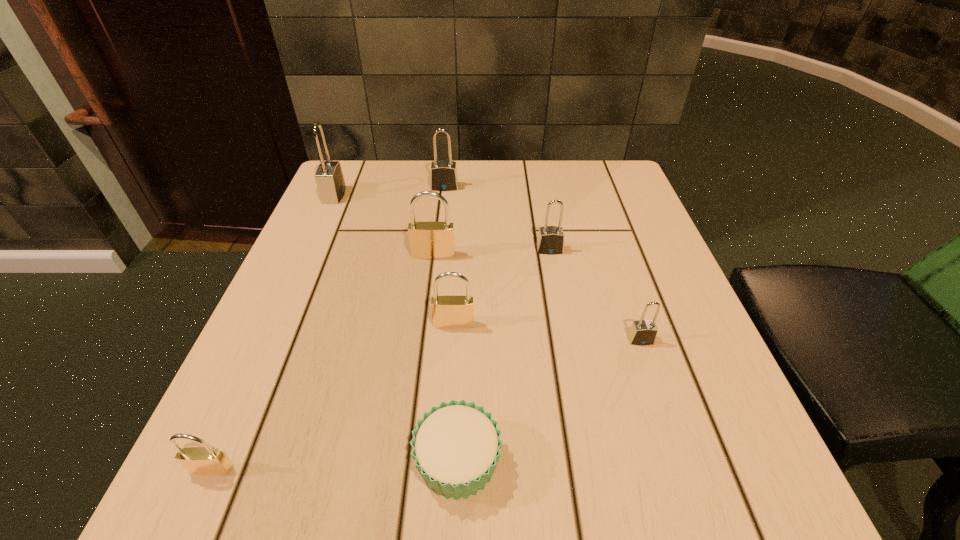
What are the coordinates of `padlock located in the near edge section of the desktop` in the screenshot? It's located at (205, 460).

Where is `cupcake that is at the near edge`? This screenshot has height=540, width=960. cupcake that is at the near edge is located at coordinates (456, 447).

Image resolution: width=960 pixels, height=540 pixels. Identify the location of object at the right edge. (642, 332).

This screenshot has height=540, width=960. I want to click on object that is at the far left corner, so click(x=329, y=177).

Locate an element on the screen. object located in the near left corner section of the desktop is located at coordinates (205, 460).

The height and width of the screenshot is (540, 960). I want to click on blank space at the far edge, so click(x=526, y=161).

I want to click on vacant area at the near edge, so click(x=625, y=452).

This screenshot has height=540, width=960. In the image, there is a desktop. Find the location of `blank space at the left edge`. blank space at the left edge is located at coordinates (378, 214).

You are a GUI agent. You are given a task and a screenshot of the screen. Output one action in this format:
    pyautogui.click(x=<x>, y=<y>)
    Task: Click on the vacant space at the right edge
    Image resolution: width=960 pixels, height=540 pixels.
    Given the screenshot: What is the action you would take?
    pyautogui.click(x=692, y=387)

In the image, there is a desktop. At what (x,y) coordinates should I click in order to perform the action: click on free space at the far left corner. Please return your answer as a coordinate pair (x, y). This screenshot has height=540, width=960. Looking at the image, I should click on (375, 195).